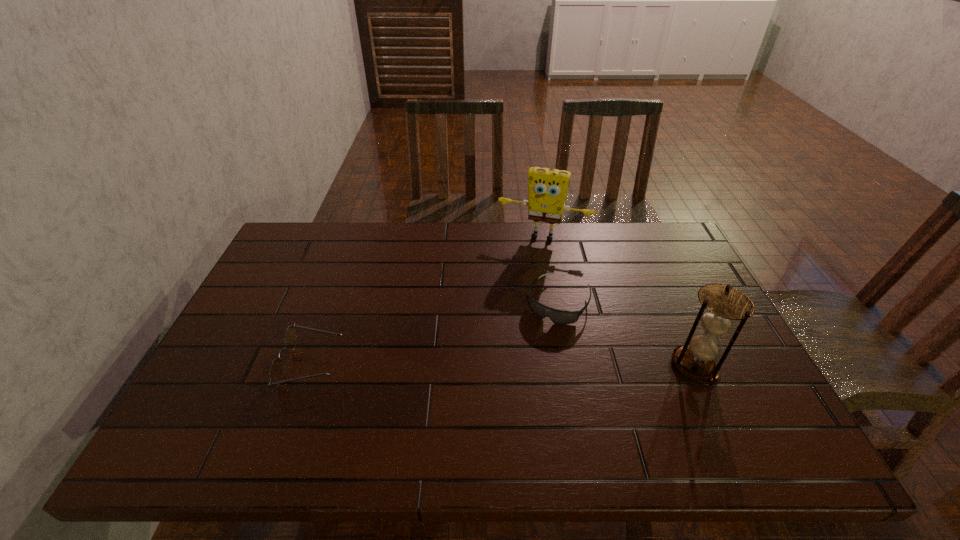
Locate an element on the screen. This screenshot has width=960, height=540. spectacles is located at coordinates (276, 369).

You are a GUI agent. You are given a task and a screenshot of the screen. Output one action in this format:
    pyautogui.click(x=<x>, y=<y>)
    Task: Click on the rightmost object
    This screenshot has width=960, height=540.
    Given the screenshot: What is the action you would take?
    pyautogui.click(x=722, y=304)

Image resolution: width=960 pixels, height=540 pixels. In order to click on goggles in this screenshot , I will do `click(557, 316)`.

Where is `the third nearest object`? This screenshot has width=960, height=540. the third nearest object is located at coordinates (557, 316).

At what (x,y) coordinates should I click in order to perform the action: click on sponge. Please return your answer as a coordinate pair (x, y). Image resolution: width=960 pixels, height=540 pixels. Looking at the image, I should click on (547, 188).

Locate an element on the screen. The height and width of the screenshot is (540, 960). free location located 0.370m on the front-facing side of the leftmost object is located at coordinates (490, 364).

Locate an element on the screen. The image size is (960, 540). vacant space located 0.340m on the left of the hourglass is located at coordinates (533, 365).

The width and height of the screenshot is (960, 540). Identify the location of vacant space located 0.080m on the lenses of the second farthest object. (535, 345).

What are the coordinates of `vacant space situated on the lenses of the second farthest object` in the screenshot? It's located at (494, 418).

Identify the location of free space located 0.240m on the lenses of the second farthest object. The height and width of the screenshot is (540, 960). (x=509, y=392).